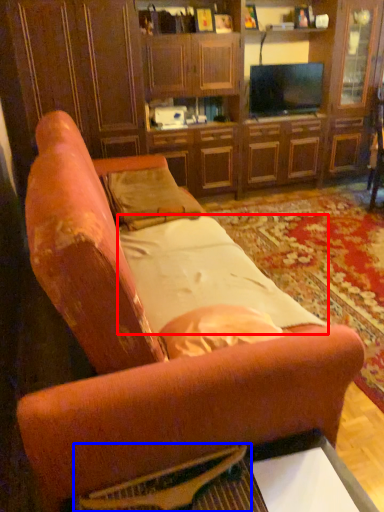
Question: Which object appears closest to the camera in this image, sheet (highlighted by a red box) or flat (highlighted by a blue box)?

Choices:
 (A) sheet
 (B) flat

Answer: (B)